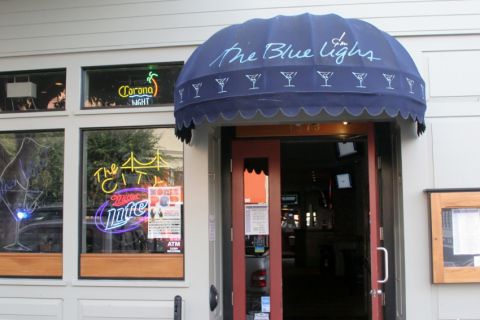
Find the location of a particular element. wall is located at coordinates (453, 140).